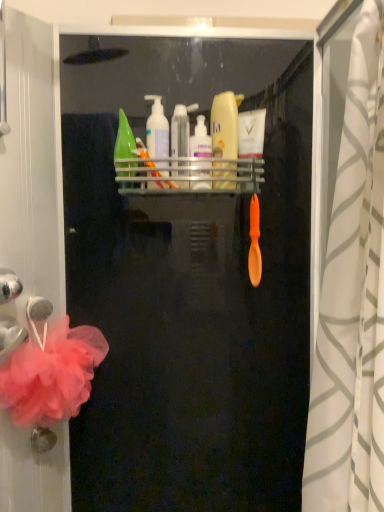
Question: From the image's perspective, is white plastic pump bottle at upper center, positioned as the 3th toiletry in left-to-right order, over white textured shower curtain at right?

Choices:
 (A) no
 (B) yes

Answer: (B)

Question: Is white plastic pump bottle at upper center, positioned as the 3th toiletry in left-to-right order, shorter than white textured shower curtain at right?

Choices:
 (A) yes
 (B) no

Answer: (A)

Question: Can you confirm if white plastic pump bottle at upper center, positioned as the 3th toiletry in left-to-right order, is positioned to the left of white textured shower curtain at right?

Choices:
 (A) yes
 (B) no

Answer: (A)

Question: Is white plastic pump bottle at upper center, positioned as the 3th toiletry in left-to-right order, not near white textured shower curtain at right?

Choices:
 (A) yes
 (B) no

Answer: (B)

Question: From the image's perspective, is white plastic pump bottle at upper center, positioned as the 3th toiletry in left-to-right order, located beneath white textured shower curtain at right?

Choices:
 (A) no
 (B) yes

Answer: (A)

Question: Does point (302, 125) appear closer or farther from the camera than point (39, 311)?

Choices:
 (A) closer
 (B) farther

Answer: (B)

Question: From the image's perspective, is transparent plastic screen door at upper center above or below metallic silver towel bar at left?

Choices:
 (A) below
 (B) above

Answer: (B)

Question: In terms of width, does transparent plastic screen door at upper center look wider or thinner when compared to metallic silver towel bar at left?

Choices:
 (A) wide
 (B) thin

Answer: (A)

Question: Is transparent plastic screen door at upper center taller or shorter than metallic silver towel bar at left?

Choices:
 (A) short
 (B) tall

Answer: (B)

Question: In terms of width, does white textured shower curtain at right look wider or thinner when compared to transparent plastic tube at center, positioned as the second toiletry in left-to-right order?

Choices:
 (A) thin
 (B) wide

Answer: (B)

Question: Considering their positions, is white textured shower curtain at right located in front of or behind transparent plastic tube at center, arranged as the 3th toiletry when viewed from the right?

Choices:
 (A) behind
 (B) front

Answer: (B)

Question: Is white textured shower curtain at right bigger or smaller than transparent plastic tube at center, positioned as the second toiletry in left-to-right order?

Choices:
 (A) big
 (B) small

Answer: (A)

Question: Which is correct: white textured shower curtain at right is inside transparent plastic tube at center, positioned as the second toiletry in left-to-right order, or outside of it?

Choices:
 (A) outside
 (B) inside

Answer: (A)

Question: From the image's perspective, relative to metallic silver shelf at upper center, is transparent plastic screen door at upper center above or below?

Choices:
 (A) below
 (B) above

Answer: (A)

Question: Is transparent plastic screen door at upper center taller or shorter than metallic silver shelf at upper center?

Choices:
 (A) short
 (B) tall

Answer: (B)